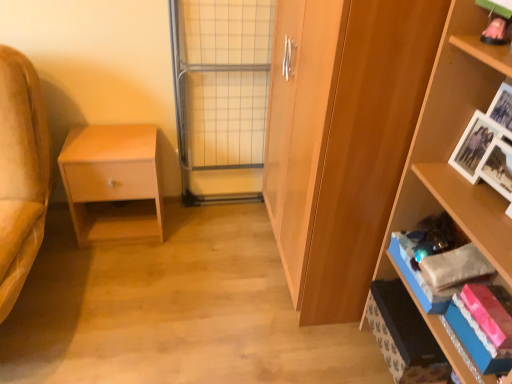
The height and width of the screenshot is (384, 512). I want to click on vacant space to the right of matte wood nightstand at left, so click(x=191, y=241).